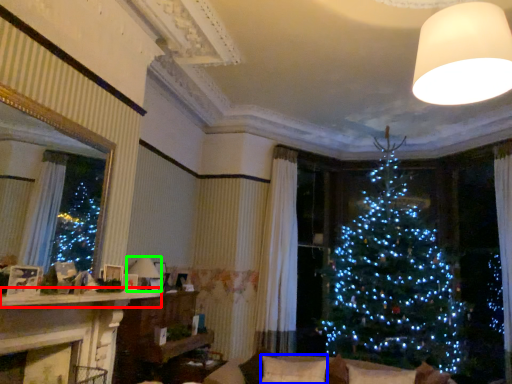
Question: Which is farther away from mantle (highlighted by a red box)? pillow (highlighted by a blue box) or lamp (highlighted by a green box)?

Choices:
 (A) pillow
 (B) lamp

Answer: (A)